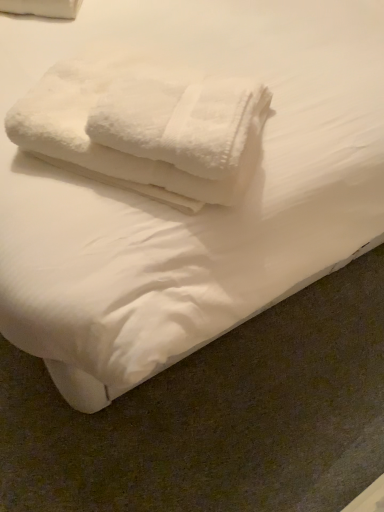
The width and height of the screenshot is (384, 512). What do you see at coordinates (146, 124) in the screenshot? I see `white fluffy towels at upper center` at bounding box center [146, 124].

The width and height of the screenshot is (384, 512). Identify the location of white fluffy towels at upper center. (146, 124).

In order to face white fluffy towels at upper center, should I rotate leftwards or rightwards?

A 5.434 degree turn to the left will do.

At what (x,y) coordinates should I click in order to perform the action: click on white fluffy towels at upper center. Please return your answer as a coordinate pair (x, y). This screenshot has width=384, height=512. Looking at the image, I should click on (146, 124).